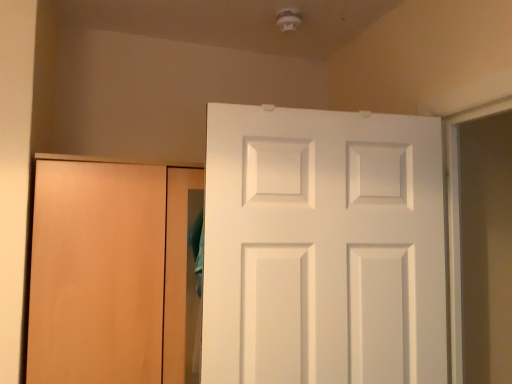
Question: In terms of height, does white matte door at center, positioned as the first door in right-to-left order, look taller or shorter compared to matte wood door at left, arranged as the 1th door when viewed from the left?

Choices:
 (A) tall
 (B) short

Answer: (B)

Question: Is white matte door at center, positioned as the first door in right-to-left order, to the left or to the right of matte wood door at left, arranged as the 1th door when viewed from the left, in the image?

Choices:
 (A) right
 (B) left

Answer: (A)

Question: Considering the positions of point (331, 294) and point (54, 172), is point (331, 294) closer or farther from the camera than point (54, 172)?

Choices:
 (A) closer
 (B) farther

Answer: (A)

Question: Is matte wood door at left, which ranks as the second door in right-to-left order, spatially inside white matte door at center, the second door when ordered from left to right, or outside of it?

Choices:
 (A) outside
 (B) inside

Answer: (A)

Question: Relative to white matte door at center, positioned as the first door in right-to-left order, is matte wood door at left, which ranks as the second door in right-to-left order, in front or behind?

Choices:
 (A) front
 (B) behind

Answer: (B)

Question: From a real-world perspective, is matte wood door at left, which ranks as the second door in right-to-left order, physically located above or below white matte door at center, positioned as the first door in right-to-left order?

Choices:
 (A) above
 (B) below

Answer: (B)

Question: From the image's perspective, is matte wood door at left, which ranks as the second door in right-to-left order, above or below white matte door at center, the second door when ordered from left to right?

Choices:
 (A) below
 (B) above

Answer: (A)